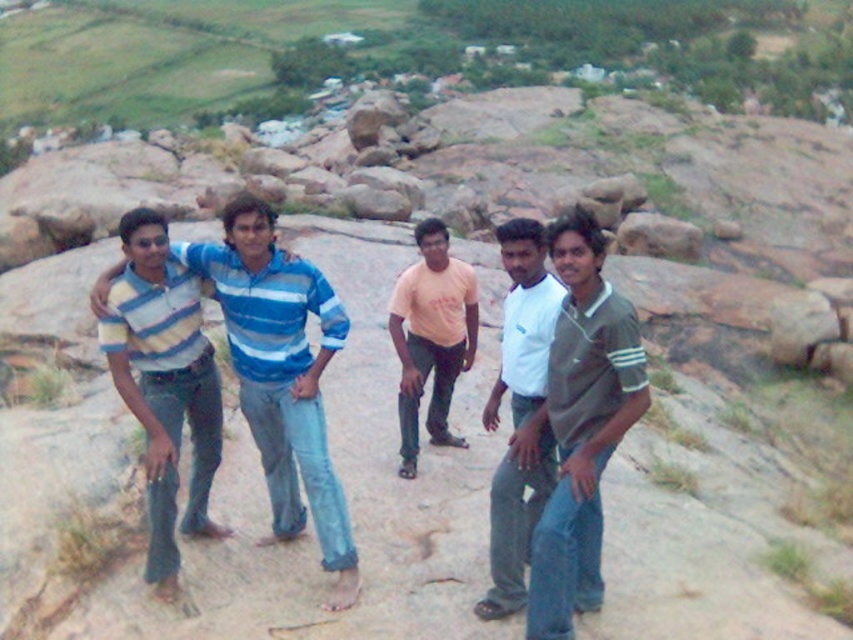
Who is shorter, striped cotton shirt at left or orange t-shirt at center?

With less height is orange t-shirt at center.

Does point (136, 211) come behind point (474, 282)?

No.

Does point (157, 536) come in front of point (418, 262)?

Yes, point (157, 536) is in front of point (418, 262).

Locate an element on the screen. The width and height of the screenshot is (853, 640). striped cotton shirt at left is located at coordinates (164, 384).

Who is taller, striped cotton shirt at left or white cotton shirt at center?

white cotton shirt at center is taller.

Is point (194, 504) less distant than point (544, 477)?

No, it is behind (544, 477).

Is point (216, 460) closer to camera compared to point (515, 333)?

No, it is behind (515, 333).

Identify the location of striped cotton shirt at left. The height and width of the screenshot is (640, 853). (164, 384).

At what (x,y) coordinates should I click in order to perform the action: click on striped cotton shirt at center. Please return your answer as a coordinate pair (x, y). The image size is (853, 640). Looking at the image, I should click on (282, 374).

Consider the image. Is striped cotton shirt at center below orange t-shirt at center?

Yes.

Measure the distance between point (349, 540) and camera.

They are 7.18 meters apart.

At what (x,y) coordinates should I click in order to perform the action: click on striped cotton shirt at center. Please return your answer as a coordinate pair (x, y). The height and width of the screenshot is (640, 853). Looking at the image, I should click on (282, 374).